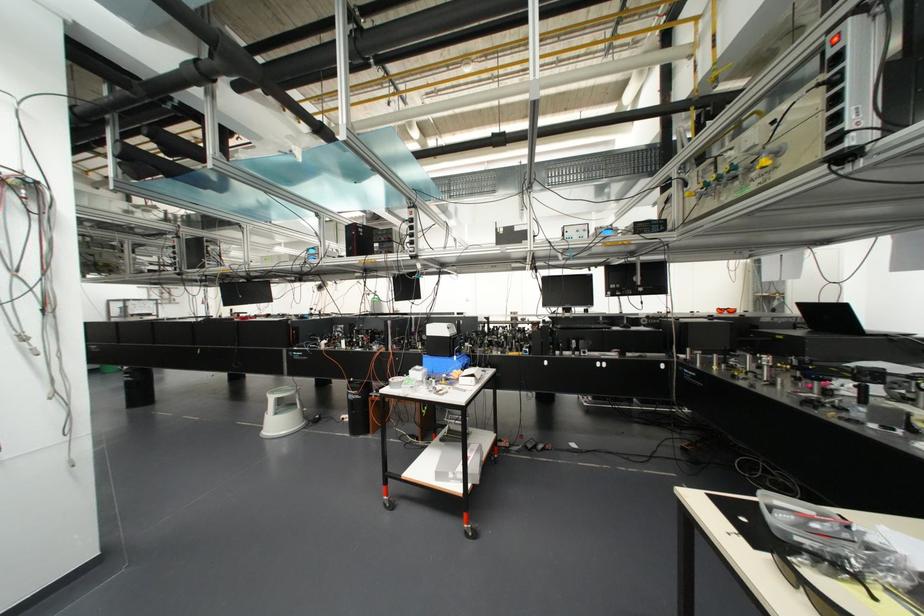
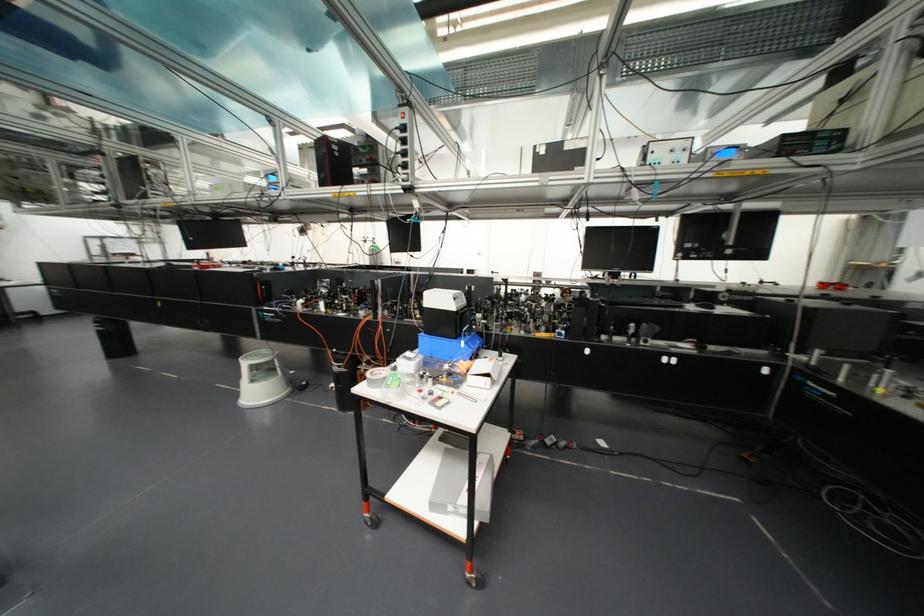
Question: I am providing you with two images of the same scene from different viewpoints. After the viewpoint changes to image2, which objects are now occluded?

Choices:
 (A) grey step stool
 (B) black keyboard
 (C) small white box
 (D) none of these

Answer: (D)